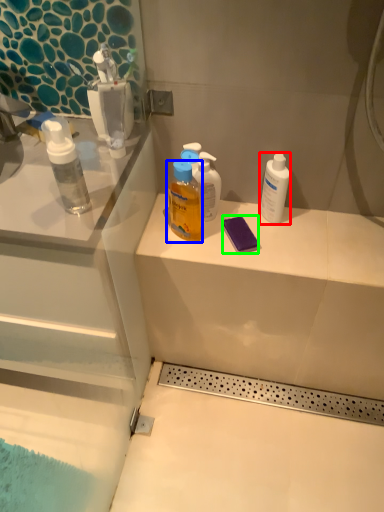
Question: Which is farther away from mouthwash (highlighted by a red box)? bottle (highlighted by a blue box) or soap (highlighted by a green box)?

Choices:
 (A) bottle
 (B) soap

Answer: (A)